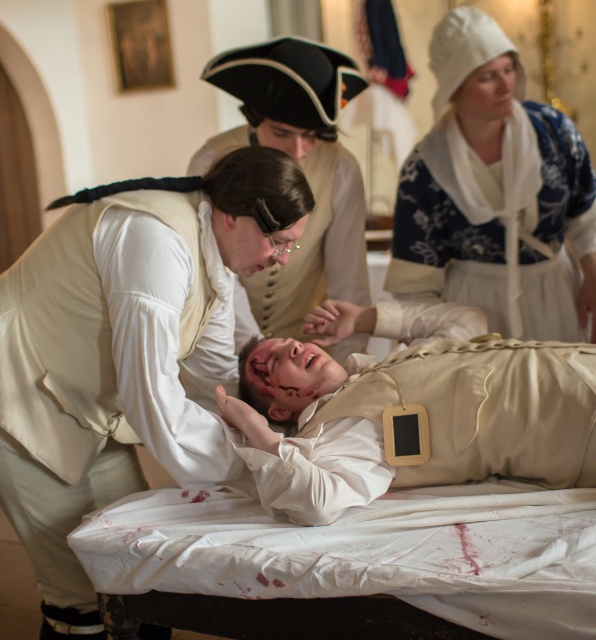
Image resolution: width=596 pixels, height=640 pixels. I want to click on beige fabric baby at center, so click(439, 426).

Is point (405, 424) more distant than point (224, 84)?

No.

What do you see at coordinates (439, 426) in the screenshot? I see `beige fabric baby at center` at bounding box center [439, 426].

Where is `beige fabric baby at center`? beige fabric baby at center is located at coordinates click(439, 426).

Does point (198, 285) come closer to viewer compared to point (526, 476)?

No, it is not.

Which is above, matte white shirt at center or beige fabric baby at center?

matte white shirt at center is above.

Locate an element on the screen. This screenshot has height=640, width=596. matte white shirt at center is located at coordinates (123, 349).

The width and height of the screenshot is (596, 640). In order to click on matte white shirt at center in this screenshot , I will do `click(123, 349)`.

In order to click on white floral dress at upper right in this screenshot , I will do `click(495, 193)`.

Which is above, white floral dress at upper right or beige fabric baby at center?

white floral dress at upper right

This screenshot has width=596, height=640. What are the coordinates of `white floral dress at upper right` in the screenshot? It's located at (495, 193).